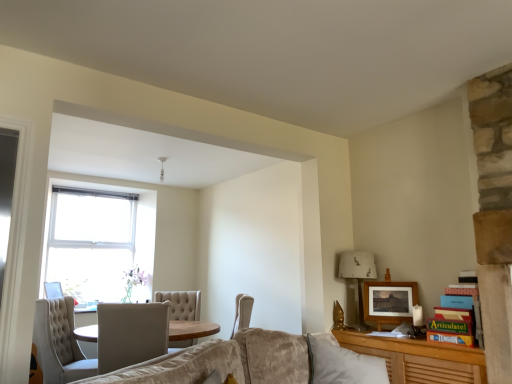
Question: In terms of size, does white fabric lampshade at right appear bigger or smaller than tufted fabric chair at lower left, the second chair viewed from the right?

Choices:
 (A) big
 (B) small

Answer: (B)

Question: Is point (356, 264) positioned closer to the camera than point (42, 380)?

Choices:
 (A) farther
 (B) closer

Answer: (A)

Question: Considering the real-world distances, which object is farthest from the wooden picture frame at lower left, the 1th picture frame from the bottom?

Choices:
 (A) matte wooden picture frame at upper right, marked as the second picture frame in a bottom-to-top arrangement
 (B) white fabric lampshade at right
 (C) white tufted chair at center, which is counted as the second chair, starting from the left
 (D) tufted fabric chair at lower left, the first chair from the left

Answer: (A)

Question: Estimate the real-world distances between objects in this image. Which object is farther from the tufted fabric chair at lower left, the first chair from the left?

Choices:
 (A) wooden picture frame at lower left, marked as the second picture frame in a right-to-left arrangement
 (B) white tufted chair at center, which is counted as the second chair, starting from the left
 (C) matte wooden picture frame at upper right, placed as the first picture frame when sorted from top to bottom
 (D) white fabric lampshade at right

Answer: (C)